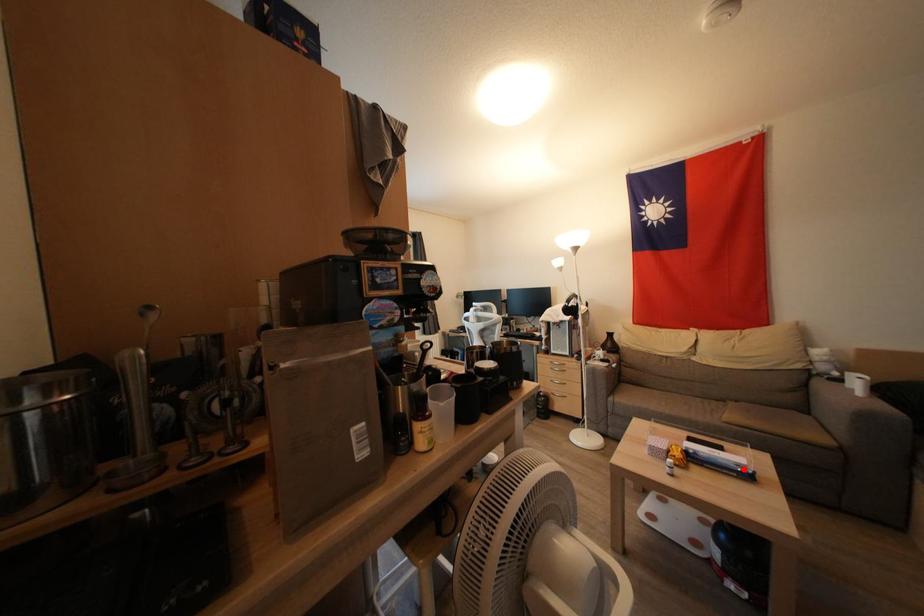
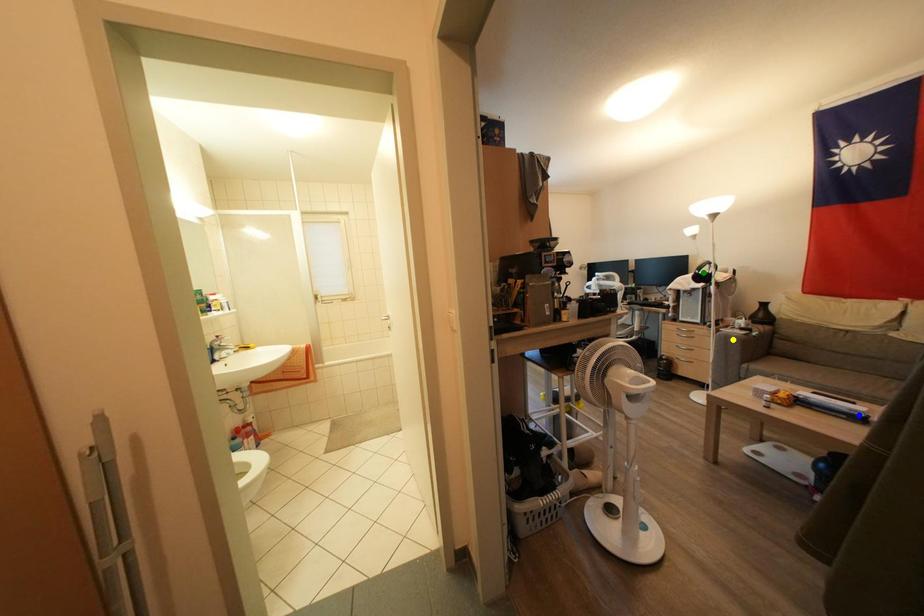
Question: I am providing you with two images of the same scene from different viewpoints. A red point is marked on the first image. You are given multiple points on the second image. Which point in image 2 represents the same 3d spot as the red point in image 1?

Choices:
 (A) blue point
 (B) green point
 (C) yellow point

Answer: (A)